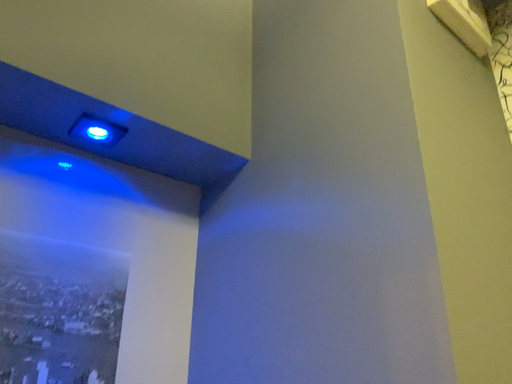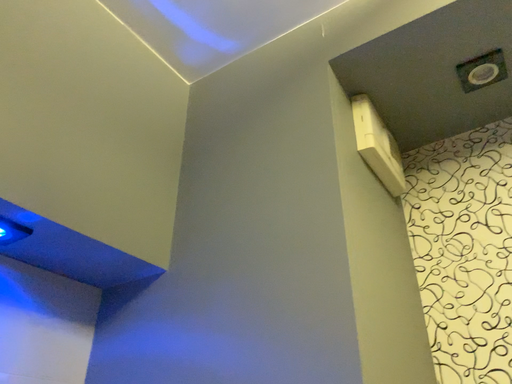
Question: Which way did the camera rotate in the video?

Choices:
 (A) rotated upward
 (B) rotated downward

Answer: (A)